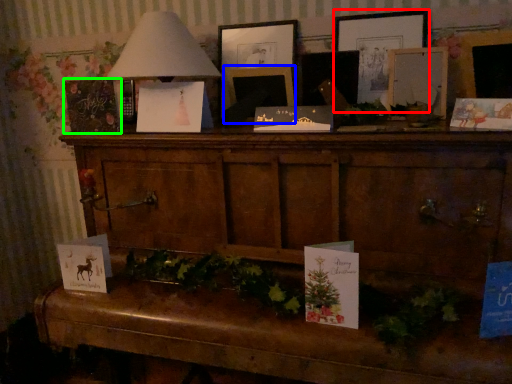
Question: Considering the real-world distances, which object is farthest from picture frame (highlighted by a red box)? picture frame (highlighted by a blue box) or christmas card (highlighted by a green box)?

Choices:
 (A) picture frame
 (B) christmas card

Answer: (B)